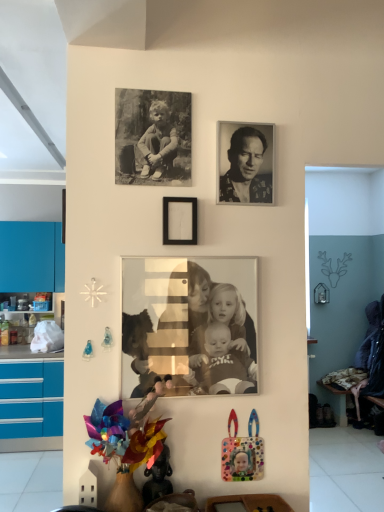
Question: Is black and white photograph of a man at upper center, which appears as the first person when viewed from the top, positioned with its back to multicolored plastic flower at lower left?

Choices:
 (A) no
 (B) yes

Answer: (A)

Question: Is black and white photograph of a man at upper center, the 2th person ordered from the bottom, bigger than multicolored plastic flower at lower left?

Choices:
 (A) no
 (B) yes

Answer: (A)

Question: Are black and white photograph of a man at upper center, the 2th person ordered from the bottom, and multicolored plastic flower at lower left far apart?

Choices:
 (A) yes
 (B) no

Answer: (B)

Question: Does black and white photograph of a man at upper center, which appears as the first person when viewed from the top, have a lesser width compared to multicolored plastic flower at lower left?

Choices:
 (A) no
 (B) yes

Answer: (B)

Question: From the image's perspective, is black and white photograph of a man at upper center, the 2th person ordered from the bottom, on multicolored plastic flower at lower left?

Choices:
 (A) no
 (B) yes

Answer: (B)

Question: Is black and white photograph of a man at upper center, the 2th person ordered from the bottom, further to the viewer compared to multicolored plastic flower at lower left?

Choices:
 (A) no
 (B) yes

Answer: (B)

Question: Can you confirm if black matte picture frame at center, which is counted as the second picture frame, starting from the top, is taller than black and white photograph of a man at upper center, the 2th person ordered from the bottom?

Choices:
 (A) no
 (B) yes

Answer: (A)

Question: Is black matte picture frame at center, which is counted as the second picture frame, starting from the top, turned away from black and white photograph of a man at upper center, which appears as the first person when viewed from the top?

Choices:
 (A) no
 (B) yes

Answer: (A)

Question: Is black matte picture frame at center, marked as the 1th picture frame in a bottom-to-top arrangement, thinner than black and white photograph of a man at upper center, which appears as the first person when viewed from the top?

Choices:
 (A) no
 (B) yes

Answer: (A)

Question: From a real-world perspective, is black matte picture frame at center, marked as the 1th picture frame in a bottom-to-top arrangement, positioned under black and white photograph of a man at upper center, the 2th person ordered from the bottom, based on gravity?

Choices:
 (A) yes
 (B) no

Answer: (A)

Question: Are black matte picture frame at center, which is counted as the second picture frame, starting from the top, and black and white photograph of a man at upper center, the 2th person ordered from the bottom, far apart?

Choices:
 (A) yes
 (B) no

Answer: (B)

Question: Does black matte picture frame at center, which is counted as the second picture frame, starting from the top, have a greater width compared to black and white photograph of a man at upper center, which appears as the first person when viewed from the top?

Choices:
 (A) yes
 (B) no

Answer: (A)

Question: Is black matte picture frame at center, marked as the 1th picture frame in a bottom-to-top arrangement, surrounded by sepia-toned photograph of family at center, marked as the first person in a bottom-to-top arrangement?

Choices:
 (A) no
 (B) yes

Answer: (A)